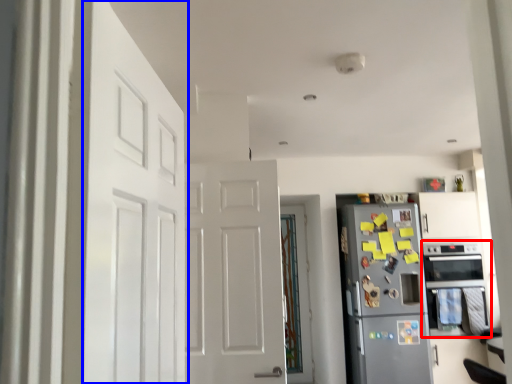
Question: Which of the following is the farthest to the observer, oven (highlighted by a red box) or door (highlighted by a blue box)?

Choices:
 (A) oven
 (B) door

Answer: (A)